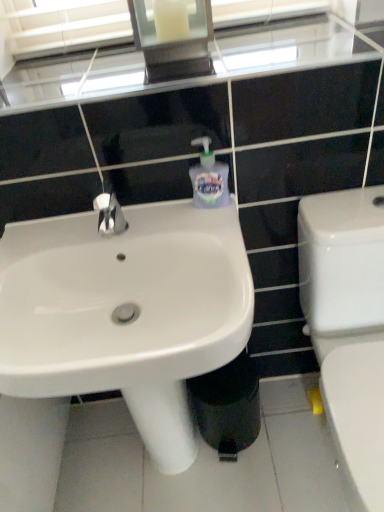
Where is `translucent plastic soap dispenser at center`? translucent plastic soap dispenser at center is located at coordinates (209, 178).

This screenshot has width=384, height=512. Describe the element at coordinates (228, 406) in the screenshot. I see `black plastic trash bin/can at lower center` at that location.

The image size is (384, 512). What are the coordinates of `white glossy toilet at right` in the screenshot? It's located at (348, 327).

Image resolution: width=384 pixels, height=512 pixels. What are the coordinates of `translucent plastic soap dispenser at center` in the screenshot? It's located at (209, 178).

From the picture: Is black plastic trash bin/can at lower center positioned before translucent plastic soap dispenser at center?

No, it is not.

Considering the relative sizes of black plastic trash bin/can at lower center and translucent plastic soap dispenser at center in the image provided, is black plastic trash bin/can at lower center taller than translucent plastic soap dispenser at center?

Yes.

Between black plastic trash bin/can at lower center and translucent plastic soap dispenser at center, which one appears on the right side from the viewer's perspective?

black plastic trash bin/can at lower center.

Based on the photo, from a real-world perspective, is translucent plastic soap dispenser at center on white glossy toilet at right?

Yes, from a real-world perspective, translucent plastic soap dispenser at center is over white glossy toilet at right

Which of these two, translucent plastic soap dispenser at center or white glossy toilet at right, stands taller?

With more height is white glossy toilet at right.

In terms of size, does translucent plastic soap dispenser at center appear bigger or smaller than white glossy toilet at right?

In the image, translucent plastic soap dispenser at center appears to be smaller than white glossy toilet at right.

Is translucent plastic soap dispenser at center facing towards white glossy toilet at right?

No, translucent plastic soap dispenser at center is not oriented towards white glossy toilet at right.

Which object is further away from the camera, white glossy toilet at right or white glossy sink at center?

white glossy sink at center is further from the camera.

The width and height of the screenshot is (384, 512). In order to click on sink behind the white glossy toilet at right in this screenshot , I will do `click(126, 312)`.

Based on the photo, is white glossy sink at center at the back of white glossy toilet at right?

No, white glossy toilet at right is not facing away from white glossy sink at center.

From a real-world perspective, which is physically below, black plastic trash bin/can at lower center or white glossy sink at center?

black plastic trash bin/can at lower center.

Consider the image. Does black plastic trash bin/can at lower center turn towards white glossy sink at center?

No, black plastic trash bin/can at lower center does not turn towards white glossy sink at center.

Is white glossy sink at center located within black plastic trash bin/can at lower center?

Actually, white glossy sink at center is outside black plastic trash bin/can at lower center.

From their relative heights in the image, would you say white glossy sink at center is taller or shorter than translucent plastic soap dispenser at center?

white glossy sink at center is taller than translucent plastic soap dispenser at center.

Is white glossy sink at center to the left or to the right of translucent plastic soap dispenser at center in the image?

white glossy sink at center is positioned on translucent plastic soap dispenser at center's left side.

At what (x,y) coordinates should I click in order to perform the action: click on toiletries above the white glossy sink at center (from a real-world perspective). Please return your answer as a coordinate pair (x, y). Image resolution: width=384 pixels, height=512 pixels. Looking at the image, I should click on (209, 178).

Is the depth of white glossy sink at center greater than that of translucent plastic soap dispenser at center?

That is False.

Identify the location of toiletries above the white glossy toilet at right (from the image's perspective). Image resolution: width=384 pixels, height=512 pixels. (209, 178).

Which object is further away from the camera, white glossy toilet at right or translucent plastic soap dispenser at center?

translucent plastic soap dispenser at center.

Can you confirm if white glossy toilet at right is wider than translucent plastic soap dispenser at center?

Correct, the width of white glossy toilet at right exceeds that of translucent plastic soap dispenser at center.

Is point (217, 204) behind point (213, 441)?

No.

Is black plastic trash bin/can at lower center at the back of translucent plastic soap dispenser at center?

translucent plastic soap dispenser at center does not have its back to black plastic trash bin/can at lower center.

From a real-world perspective, is translucent plastic soap dispenser at center under black plastic trash bin/can at lower center?

No, from a real-world perspective, translucent plastic soap dispenser at center is not beneath black plastic trash bin/can at lower center.

Do you think translucent plastic soap dispenser at center is within black plastic trash bin/can at lower center, or outside of it?

translucent plastic soap dispenser at center is not enclosed by black plastic trash bin/can at lower center.

You are a GUI agent. You are given a task and a screenshot of the screen. Output one action in this format:
    pyautogui.click(x=<x>, y=<y>)
    Task: Click on the trash bin/can that appears below the translucent plastic soap dispenser at center (from a real-world perspective)
    
    Given the screenshot: What is the action you would take?
    pyautogui.click(x=228, y=406)

Find the location of `toiletries above the white glossy toilet at right (from a real-world perspective)`. toiletries above the white glossy toilet at right (from a real-world perspective) is located at coordinates (209, 178).

Estimate the real-world distances between objects in this image. Which object is closer to translucent plastic soap dispenser at center, white glossy toilet at right or black plastic trash bin/can at lower center?

Among the two, white glossy toilet at right is located nearer to translucent plastic soap dispenser at center.

When comparing their distances from white glossy sink at center, does black plastic trash bin/can at lower center or white glossy toilet at right seem further?

white glossy toilet at right.

When comparing their distances from black plastic trash bin/can at lower center, does white glossy sink at center or translucent plastic soap dispenser at center seem further?

The object further to black plastic trash bin/can at lower center is translucent plastic soap dispenser at center.

Estimate the real-world distances between objects in this image. Which object is closer to white glossy sink at center, white glossy toilet at right or black plastic trash bin/can at lower center?

The object closer to white glossy sink at center is black plastic trash bin/can at lower center.

Looking at this image, considering their positions, is translucent plastic soap dispenser at center positioned further to white glossy toilet at right than white glossy sink at center?

Among the two, white glossy sink at center is located further to white glossy toilet at right.

When comparing their distances from white glossy toilet at right, does white glossy sink at center or black plastic trash bin/can at lower center seem closer?

Among the two, black plastic trash bin/can at lower center is located nearer to white glossy toilet at right.

Considering their positions, is black plastic trash bin/can at lower center positioned closer to white glossy sink at center than translucent plastic soap dispenser at center?

black plastic trash bin/can at lower center lies closer to white glossy sink at center than the other object.

From the image, which object appears to be farther from translucent plastic soap dispenser at center, black plastic trash bin/can at lower center or white glossy sink at center?

The object further to translucent plastic soap dispenser at center is black plastic trash bin/can at lower center.

Where is `toiletries between white glossy sink at center and white glossy toilet at right in the horizontal direction`? The image size is (384, 512). toiletries between white glossy sink at center and white glossy toilet at right in the horizontal direction is located at coordinates (209, 178).

Locate an element on the screen. The image size is (384, 512). trash bin/can situated between white glossy sink at center and white glossy toilet at right from left to right is located at coordinates (228, 406).

Where is `sink between translucent plastic soap dispenser at center and black plastic trash bin/can at lower center vertically`? sink between translucent plastic soap dispenser at center and black plastic trash bin/can at lower center vertically is located at coordinates point(126,312).

The height and width of the screenshot is (512, 384). In order to click on toilet between translucent plastic soap dispenser at center and black plastic trash bin/can at lower center vertically in this screenshot , I will do `click(348, 327)`.